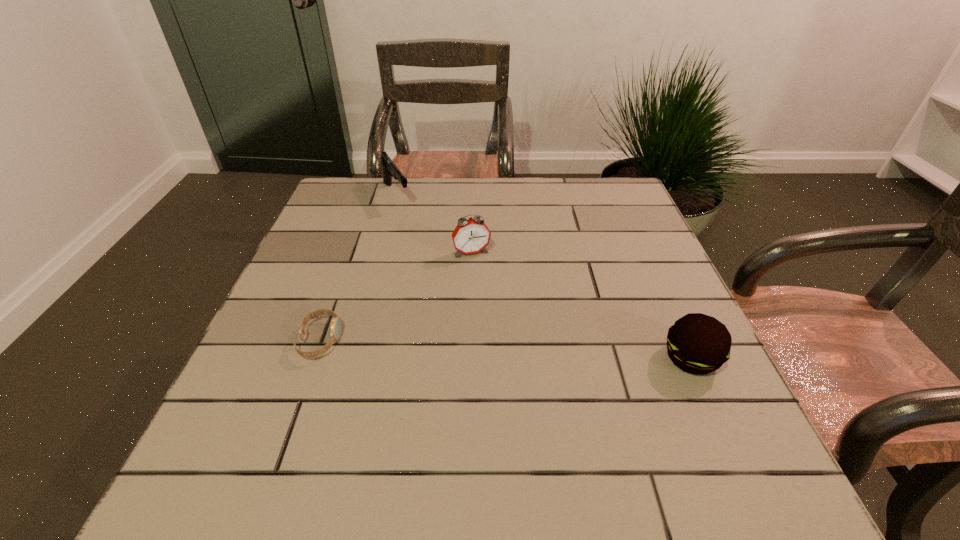
Where is `free region located on the clock face of the third object from left to right`? The width and height of the screenshot is (960, 540). free region located on the clock face of the third object from left to right is located at coordinates (517, 368).

Where is `blank space located 0.400m at the aiming end of the gun`? This screenshot has width=960, height=540. blank space located 0.400m at the aiming end of the gun is located at coordinates (462, 298).

The width and height of the screenshot is (960, 540). I want to click on vacant space located at the aiming end of the gun, so click(424, 244).

Find the location of a particular element. The height and width of the screenshot is (540, 960). free location located 0.090m at the aiming end of the gun is located at coordinates (412, 226).

Find the location of a particular element. object that is at the far edge is located at coordinates (390, 170).

Image resolution: width=960 pixels, height=540 pixels. I want to click on watch at the left edge, so click(x=335, y=334).

Locate an element on the screen. Image resolution: width=960 pixels, height=540 pixels. gun that is at the left edge is located at coordinates (390, 170).

In order to click on object that is at the right edge in this screenshot , I will do `click(699, 344)`.

What are the coordinates of `object that is positioned at the far left corner` in the screenshot? It's located at (390, 170).

Where is `vacant space at the far edge`? This screenshot has height=540, width=960. vacant space at the far edge is located at coordinates (392, 211).